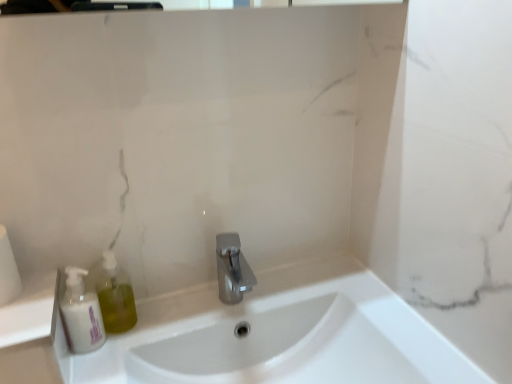
Question: Can you confirm if white matte toilet paper at left is wider than white glossy sink at center?

Choices:
 (A) yes
 (B) no

Answer: (B)

Question: From a real-world perspective, is white matte toilet paper at left located beneath white glossy sink at center?

Choices:
 (A) no
 (B) yes

Answer: (A)

Question: Does white matte toilet paper at left have a larger size compared to white glossy sink at center?

Choices:
 (A) no
 (B) yes

Answer: (A)

Question: Is the depth of white matte toilet paper at left less than that of white glossy sink at center?

Choices:
 (A) yes
 (B) no

Answer: (B)

Question: From the image's perspective, would you say white matte toilet paper at left is shown under white glossy sink at center?

Choices:
 (A) no
 (B) yes

Answer: (A)

Question: Is point (211, 370) closer or farther from the camera than point (13, 261)?

Choices:
 (A) farther
 (B) closer

Answer: (A)

Question: Considering the positions of white glossy sink at center and white matte toilet paper at left in the image, is white glossy sink at center bigger or smaller than white matte toilet paper at left?

Choices:
 (A) small
 (B) big

Answer: (B)

Question: Would you say white glossy sink at center is to the left or to the right of white matte toilet paper at left in the picture?

Choices:
 (A) right
 (B) left

Answer: (A)

Question: From the image's perspective, relative to white matte toilet paper at left, is white glossy sink at center above or below?

Choices:
 (A) below
 (B) above

Answer: (A)

Question: Visually, is polished metallic faucet at center positioned to the left or to the right of white matte bottle at left?

Choices:
 (A) left
 (B) right

Answer: (B)

Question: Looking at the image, does polished metallic faucet at center seem bigger or smaller compared to white matte bottle at left?

Choices:
 (A) small
 (B) big

Answer: (B)

Question: In terms of width, does polished metallic faucet at center look wider or thinner when compared to white matte bottle at left?

Choices:
 (A) wide
 (B) thin

Answer: (A)

Question: Would you say polished metallic faucet at center is inside or outside white matte bottle at left?

Choices:
 (A) outside
 (B) inside

Answer: (A)

Question: From the image's perspective, is white matte bottle at left located above or below polished metallic faucet at center?

Choices:
 (A) above
 (B) below

Answer: (B)

Question: Looking at their shapes, would you say white matte bottle at left is wider or thinner than polished metallic faucet at center?

Choices:
 (A) thin
 (B) wide

Answer: (A)